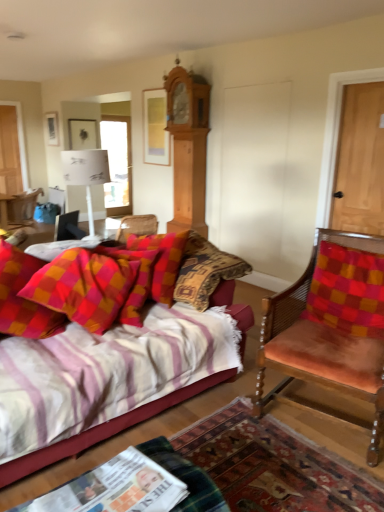
Question: Considering the relative sizes of striped fabric couch at lower left and velvet orange chair at right, which ranks as the 1th chair in bottom-to-top order, in the image provided, is striped fabric couch at lower left smaller than velvet orange chair at right, which ranks as the 1th chair in bottom-to-top order,?

Choices:
 (A) yes
 (B) no

Answer: (B)

Question: Can you confirm if striped fabric couch at lower left is positioned to the left of velvet orange chair at right, positioned as the second chair in top-to-bottom order?

Choices:
 (A) no
 (B) yes

Answer: (B)

Question: Can you confirm if striped fabric couch at lower left is thinner than velvet orange chair at right, acting as the first chair starting from the right?

Choices:
 (A) yes
 (B) no

Answer: (B)

Question: Is velvet orange chair at right, acting as the first chair starting from the right, surrounded by striped fabric couch at lower left?

Choices:
 (A) no
 (B) yes

Answer: (A)

Question: Is striped fabric couch at lower left further to the viewer compared to velvet orange chair at right, the 2th chair positioned from the back?

Choices:
 (A) yes
 (B) no

Answer: (B)

Question: In terms of size, does plush cotton pillow at center-left, the first pillow viewed from the left, appear bigger or smaller than white glossy magazine at lower center?

Choices:
 (A) small
 (B) big

Answer: (B)

Question: In terms of width, does plush cotton pillow at center-left, the first pillow viewed from the left, look wider or thinner when compared to white glossy magazine at lower center?

Choices:
 (A) thin
 (B) wide

Answer: (B)

Question: From the image's perspective, is plush cotton pillow at center-left, the second pillow viewed from the right, positioned above or below white glossy magazine at lower center?

Choices:
 (A) below
 (B) above

Answer: (B)

Question: Visually, is plush cotton pillow at center-left, the second pillow viewed from the right, positioned to the left or to the right of white glossy magazine at lower center?

Choices:
 (A) left
 (B) right

Answer: (A)

Question: From the image's perspective, is black plastic phone at lower left located above or below velvet orange chair at right, which appears as the 2th chair when viewed from the left?

Choices:
 (A) above
 (B) below

Answer: (A)

Question: Is black plastic phone at lower left taller or shorter than velvet orange chair at right, positioned as the second chair in top-to-bottom order?

Choices:
 (A) short
 (B) tall

Answer: (A)

Question: Is black plastic phone at lower left spatially inside velvet orange chair at right, the 2th chair positioned from the back, or outside of it?

Choices:
 (A) inside
 (B) outside

Answer: (B)

Question: From a real-world perspective, is black plastic phone at lower left physically located above or below velvet orange chair at right, placed as the first chair when sorted from front to back?

Choices:
 (A) above
 (B) below

Answer: (A)

Question: From their relative heights in the image, would you say plush cotton pillow at center-left, the first pillow viewed from the left, is taller or shorter than light brown wood clock at upper center?

Choices:
 (A) short
 (B) tall

Answer: (A)

Question: Is plush cotton pillow at center-left, the second pillow viewed from the right, in front of or behind light brown wood clock at upper center in the image?

Choices:
 (A) behind
 (B) front

Answer: (B)